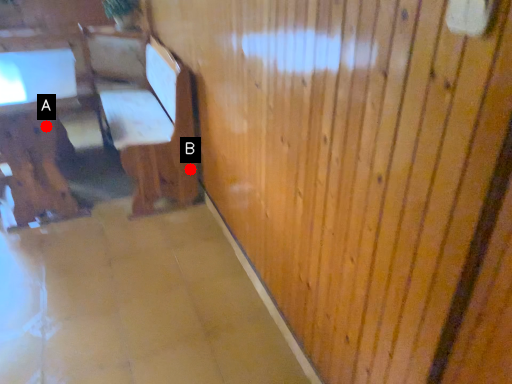
Question: Two points are circled on the image, labeled by A and B beside each circle. Which point appears closest to the camera in this image?

Choices:
 (A) A is closer
 (B) B is closer

Answer: (A)